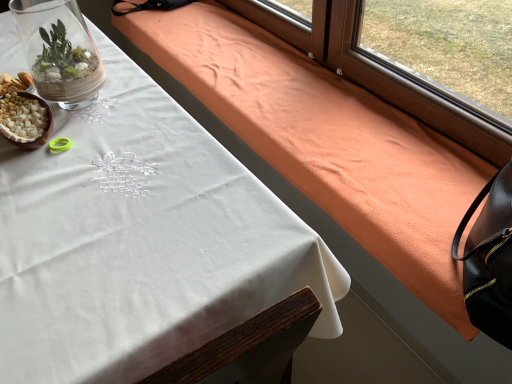
At what (x,y) coordinates should I click in order to perform the action: click on vacant area located to the right-hand side of white matte bowl at lower left. Please return your answer as a coordinate pair (x, y). This screenshot has height=384, width=512. Looking at the image, I should click on (102, 127).